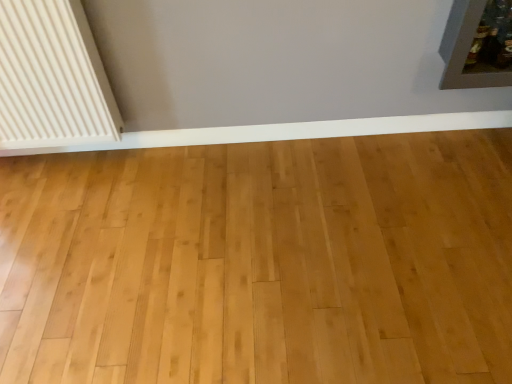
The width and height of the screenshot is (512, 384). What do you see at coordinates (52, 78) in the screenshot?
I see `white ribbed radiator at left` at bounding box center [52, 78].

The image size is (512, 384). I want to click on white ribbed radiator at left, so click(x=52, y=78).

In order to click on white smooth baseboard at lower center in this screenshot , I will do `click(288, 131)`.

Describe the element at coordinates (288, 131) in the screenshot. This screenshot has width=512, height=384. I see `white smooth baseboard at lower center` at that location.

The width and height of the screenshot is (512, 384). Find the location of `white ribbed radiator at left`. white ribbed radiator at left is located at coordinates (52, 78).

Is white smooth baseboard at lower center at the left side of white ribbed radiator at left?

Incorrect, white smooth baseboard at lower center is not on the left side of white ribbed radiator at left.

In the scene shown: Is white smooth baseboard at lower center in front of or behind white ribbed radiator at left in the image?

white smooth baseboard at lower center is positioned farther from the viewer than white ribbed radiator at left.

Considering the points (469, 118) and (3, 40), which point is behind, point (469, 118) or point (3, 40)?

The point (469, 118) is farther from the camera.

From the image's perspective, is white smooth baseboard at lower center located beneath white ribbed radiator at left?

Correct, white smooth baseboard at lower center appears lower than white ribbed radiator at left in the image.

From a real-world perspective, which object rests below the other?

From a 3D spatial view, white smooth baseboard at lower center is below.

Between white smooth baseboard at lower center and white ribbed radiator at left, which one has larger width?

Wider between the two is white ribbed radiator at left.

Which of these two, white smooth baseboard at lower center or white ribbed radiator at left, stands shorter?

Standing shorter between the two is white smooth baseboard at lower center.

Does white smooth baseboard at lower center have a larger size compared to white ribbed radiator at left?

No, white smooth baseboard at lower center is not bigger than white ribbed radiator at left.

Can we say white smooth baseboard at lower center lies outside white ribbed radiator at left?

That's correct, white smooth baseboard at lower center is outside of white ribbed radiator at left.

Is white smooth baseboard at lower center positioned far away from white ribbed radiator at left?

No, there isn't a large distance between white smooth baseboard at lower center and white ribbed radiator at left.

Is white smooth baseboard at lower center oriented away from white ribbed radiator at left?

No, white smooth baseboard at lower center is not facing away from white ribbed radiator at left.

Locate an element on the screen. This screenshot has height=384, width=512. radiator located above the white smooth baseboard at lower center (from the image's perspective) is located at coordinates (52, 78).

Between white ribbed radiator at left and white smooth baseboard at lower center, which one appears on the left side from the viewer's perspective?

Positioned to the left is white ribbed radiator at left.

Which object is closer to the camera, white ribbed radiator at left or white smooth baseboard at lower center?

white ribbed radiator at left is in front.

Does point (72, 41) lie in front of point (270, 138)?

Yes, it is.

From the image's perspective, who appears lower, white ribbed radiator at left or white smooth baseboard at lower center?

white smooth baseboard at lower center is shown below in the image.

From a real-world perspective, is white ribbed radiator at left physically below white smooth baseboard at lower center?

No, from a real-world perspective, white ribbed radiator at left is not under white smooth baseboard at lower center.

Considering the sizes of objects white ribbed radiator at left and white smooth baseboard at lower center in the image provided, who is thinner, white ribbed radiator at left or white smooth baseboard at lower center?

With smaller width is white smooth baseboard at lower center.

Can you confirm if white ribbed radiator at left is taller than white smooth baseboard at lower center?

Yes.

Can you confirm if white ribbed radiator at left is smaller than white smooth baseboard at lower center?

No.

Is white ribbed radiator at left completely or partially outside of white smooth baseboard at lower center?

Yes, white ribbed radiator at left is located beyond the bounds of white smooth baseboard at lower center.

In the scene shown: Is white ribbed radiator at left not close to white smooth baseboard at lower center?

No, white ribbed radiator at left is in close proximity to white smooth baseboard at lower center.

Is white ribbed radiator at left oriented away from white smooth baseboard at lower center?

white ribbed radiator at left does not have its back to white smooth baseboard at lower center.

Consider the image. Measure the distance from white ribbed radiator at left to white smooth baseboard at lower center.

The distance of white ribbed radiator at left from white smooth baseboard at lower center is 16.84 inches.

Where is `radiator on the left of white smooth baseboard at lower center`? radiator on the left of white smooth baseboard at lower center is located at coordinates (x=52, y=78).

This screenshot has width=512, height=384. I want to click on ledge behind the white ribbed radiator at left, so click(x=288, y=131).

The width and height of the screenshot is (512, 384). Identify the location of radiator located above the white smooth baseboard at lower center (from a real-world perspective). (52, 78).